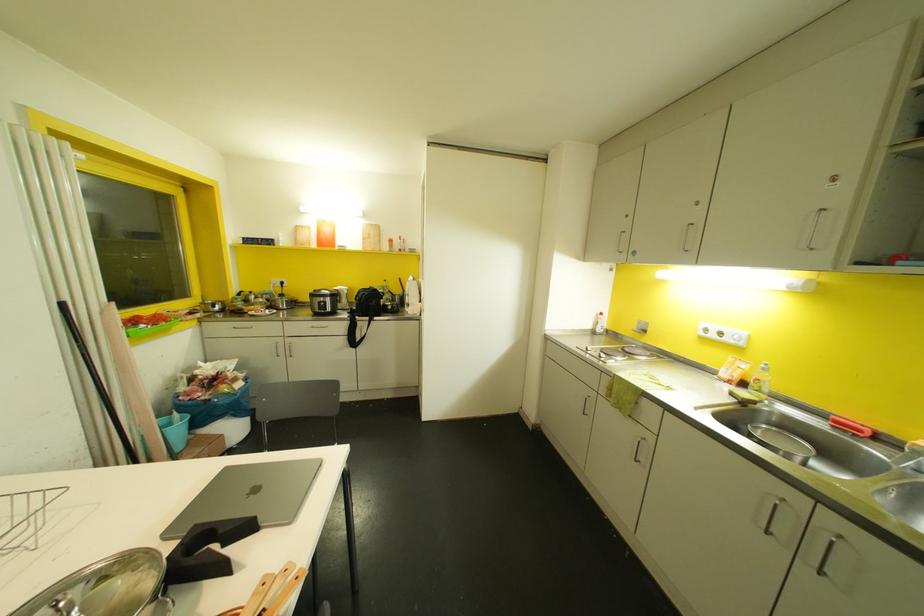
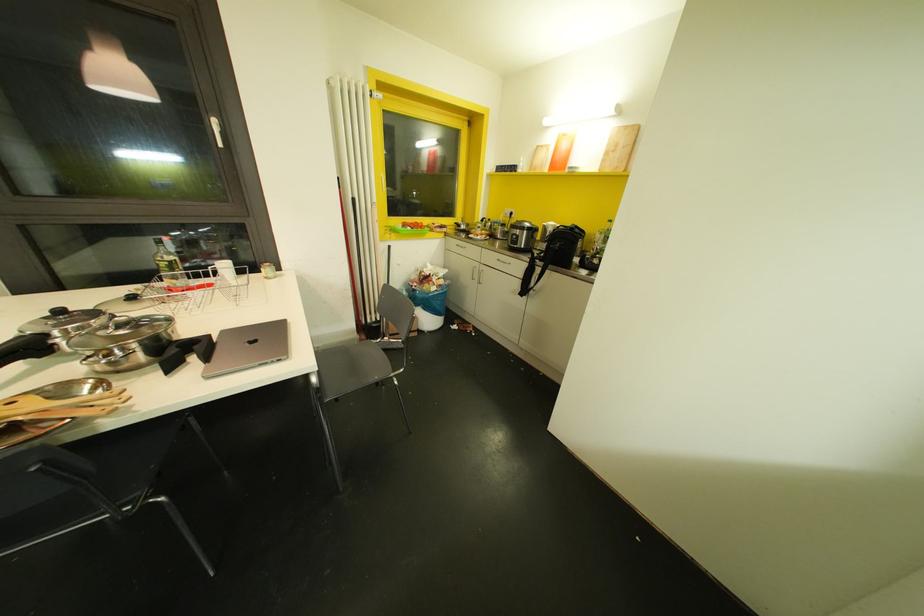
Locate, in the second image, the point that corresponds to (x=224, y=326) in the first image.

(453, 243)